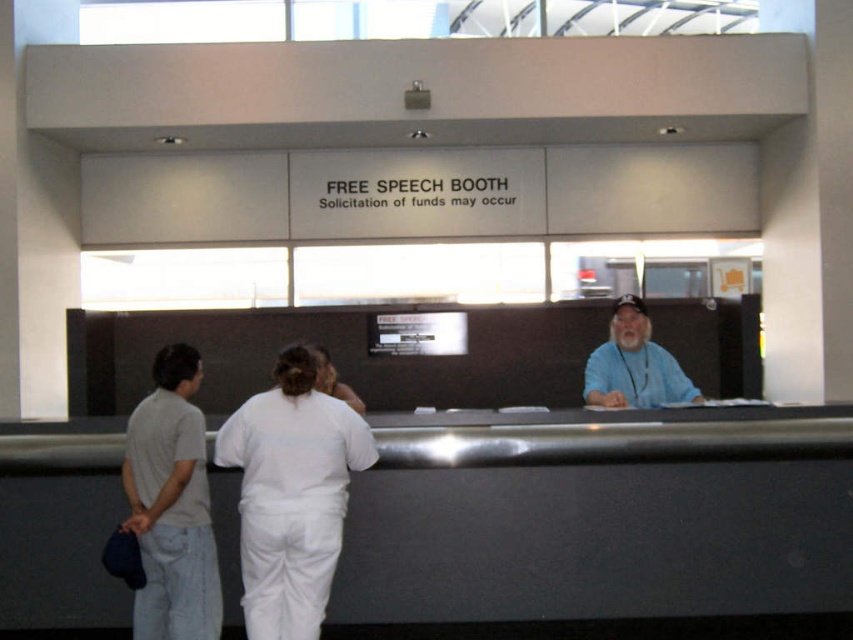
What are the coordinates of `metallic gray desk at center` in the screenshot? It's located at (601, 516).

Is metallic gray desk at center thinner than blue fabric shirt at right?

No.

Which is behind, point (634, 513) or point (641, 320)?

The point (641, 320) is more distant.

The image size is (853, 640). Find the location of `metallic gray desk at center`. metallic gray desk at center is located at coordinates (601, 516).

Does metallic gray desk at center come behind light gray cotton t-shirt at left?

Yes, metallic gray desk at center is behind light gray cotton t-shirt at left.

Which is below, metallic gray desk at center or light gray cotton t-shirt at left?

metallic gray desk at center is below.

The height and width of the screenshot is (640, 853). Describe the element at coordinates (601, 516) in the screenshot. I see `metallic gray desk at center` at that location.

This screenshot has width=853, height=640. What are the coordinates of `metallic gray desk at center` in the screenshot? It's located at (601, 516).

Who is taller, white matte uniform at center or blue fabric shirt at right?

Standing taller between the two is white matte uniform at center.

Is white matte uniform at center further to the viewer compared to blue fabric shirt at right?

That is False.

This screenshot has height=640, width=853. What are the coordinates of `white matte uniform at center` in the screenshot? It's located at (291, 493).